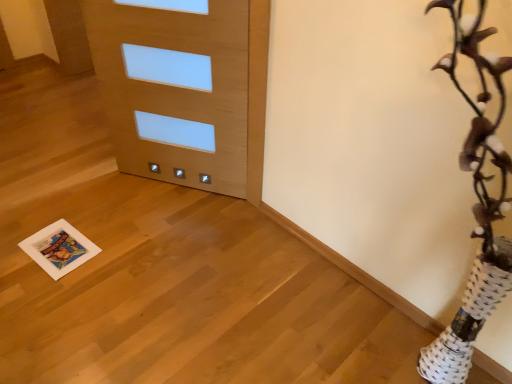
This screenshot has height=384, width=512. What do you see at coordinates (59, 248) in the screenshot? I see `white paper print at lower left` at bounding box center [59, 248].

Locate an element on the screen. white paper print at lower left is located at coordinates (59, 248).

Where is `light wood door at center`? The image size is (512, 384). light wood door at center is located at coordinates (185, 91).

What do you see at coordinates (185, 91) in the screenshot? This screenshot has height=384, width=512. I see `light wood door at center` at bounding box center [185, 91].

Image resolution: width=512 pixels, height=384 pixels. I want to click on white paper print at lower left, so click(59, 248).

Based on their positions, is light wood door at center located to the left or right of white paper print at lower left?

light wood door at center is positioned on white paper print at lower left's right side.

Relative to white paper print at lower left, is light wood door at center in front or behind?

light wood door at center is in front of white paper print at lower left.

Which point is more forward, (245, 73) or (31, 248)?

The point (245, 73) is more forward.

Consider the image. From the image's perspective, would you say light wood door at center is shown under white paper print at lower left?

Actually, light wood door at center appears above white paper print at lower left in the image.

From a real-world perspective, is light wood door at center located beneath white paper print at lower left?

No, from a real-world perspective, light wood door at center is not beneath white paper print at lower left.

Is light wood door at center thinner than white paper print at lower left?

Correct, the width of light wood door at center is less than that of white paper print at lower left.

Based on the photo, which of these two, light wood door at center or white paper print at lower left, stands taller?

light wood door at center.

Considering the relative sizes of light wood door at center and white paper print at lower left in the image provided, is light wood door at center smaller than white paper print at lower left?

Actually, light wood door at center might be larger than white paper print at lower left.

Which is correct: light wood door at center is inside white paper print at lower left, or outside of it?

light wood door at center exists outside the volume of white paper print at lower left.

In the scene shown: Are light wood door at center and white paper print at lower left making contact?

They are not placed beside each other.

Does light wood door at center turn towards white paper print at lower left?

No, light wood door at center is not turned towards white paper print at lower left.

Find the location of `door in front of the white paper print at lower left`. door in front of the white paper print at lower left is located at coordinates (185, 91).

Is white paper print at lower left to the left or to the right of light wood door at center in the image?

Based on their positions, white paper print at lower left is located to the left of light wood door at center.

Which object is closer to the camera, white paper print at lower left or light wood door at center?

light wood door at center is in front.

Does point (74, 235) come behind point (166, 103)?

No, (74, 235) is closer to viewer.

From the image's perspective, is white paper print at lower left beneath light wood door at center?

Correct, white paper print at lower left appears lower than light wood door at center in the image.

From a real-world perspective, between white paper print at lower left and light wood door at center, who is vertically higher?

light wood door at center, from a real-world perspective.

Which of these two, white paper print at lower left or light wood door at center, is thinner?

light wood door at center is thinner.

In terms of height, does white paper print at lower left look taller or shorter compared to light wood door at center?

In the image, white paper print at lower left appears to be shorter than light wood door at center.

Between white paper print at lower left and light wood door at center, which one has smaller size?

white paper print at lower left.

Is white paper print at lower left positioned beyond the bounds of light wood door at center?

white paper print at lower left lies outside light wood door at center's area.

Is white paper print at lower left far away from light wood door at center?

white paper print at lower left is near light wood door at center, not far away.

Is white paper print at lower left oriented away from light wood door at center?

No, white paper print at lower left is not facing the opposite direction of light wood door at center.

What's the angular difference between white paper print at lower left and light wood door at center's facing directions?

The angle between the facing direction of white paper print at lower left and the facing direction of light wood door at center is 112 degrees.

What are the coordinates of `print lying on the left of light wood door at center` in the screenshot? It's located at [59, 248].

At what (x,y) coordinates should I click in order to perform the action: click on door above the white paper print at lower left (from the image's perspective). Please return your answer as a coordinate pair (x, y). Looking at the image, I should click on 185,91.

Locate an element on the screen. The width and height of the screenshot is (512, 384). door on the right of white paper print at lower left is located at coordinates (185, 91).